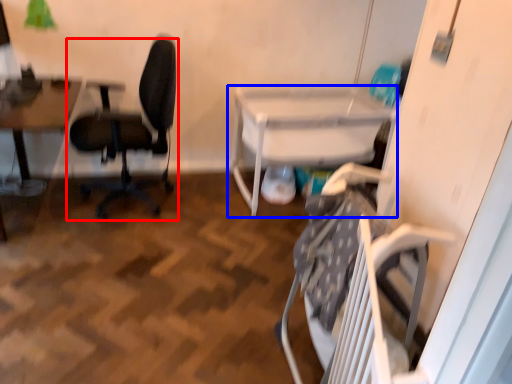
Question: Which of the following is the farthest to the observer, chair (highlighted by a red box) or table (highlighted by a blue box)?

Choices:
 (A) chair
 (B) table

Answer: (B)